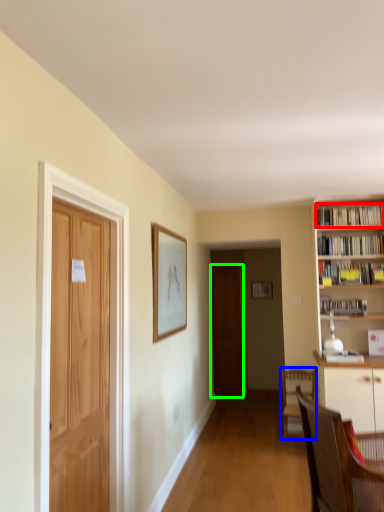
Question: Based on their relative distances, which object is farther from book (highlighted by a red box)? Choose from chair (highlighted by a blue box) and door (highlighted by a green box).

Choices:
 (A) chair
 (B) door

Answer: (B)